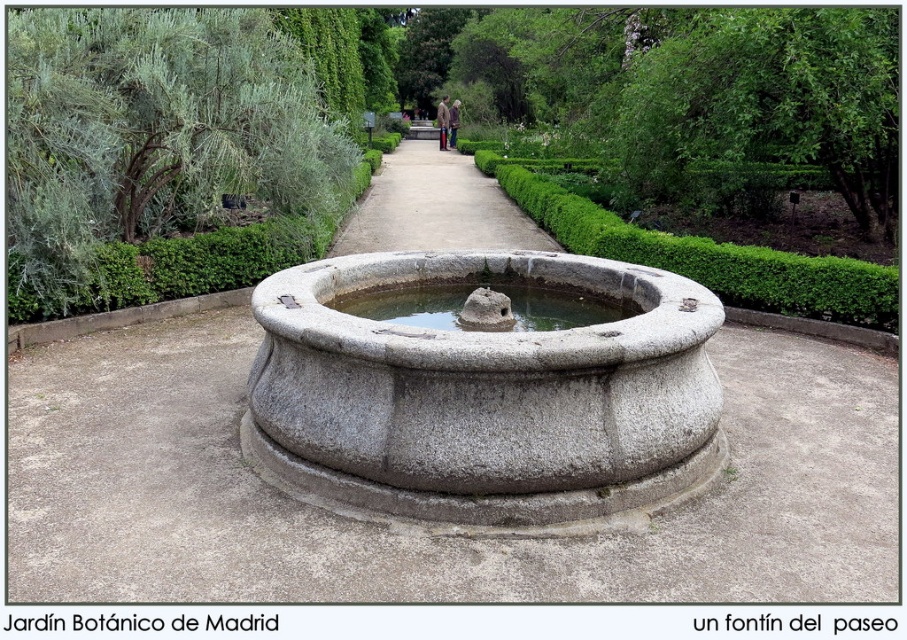
Question: Which object appears farthest from the camera in this image?

Choices:
 (A) green leafy tree at left
 (B) green textured hedge at center
 (C) gray stone fountain at center

Answer: (B)

Question: Is green leafy tree at upper center behind gray concrete path at center?

Choices:
 (A) no
 (B) yes

Answer: (A)

Question: Can you confirm if green leafy tree at upper center is thinner than clear stone water at center?

Choices:
 (A) yes
 (B) no

Answer: (B)

Question: Which object is positioned farthest from the green textured hedge at center?

Choices:
 (A) gray concrete path at center
 (B) green leafy tree at left
 (C) clear stone water at center
 (D) green leafy tree at upper center

Answer: (B)

Question: Based on their relative distances, which object is farther from the gray stone fountain at center?

Choices:
 (A) green leafy tree at left
 (B) green leafy tree at upper center
 (C) gray concrete path at center
 (D) clear stone water at center

Answer: (C)

Question: Does gray stone fountain at center have a greater width compared to green leafy tree at left?

Choices:
 (A) no
 (B) yes

Answer: (B)